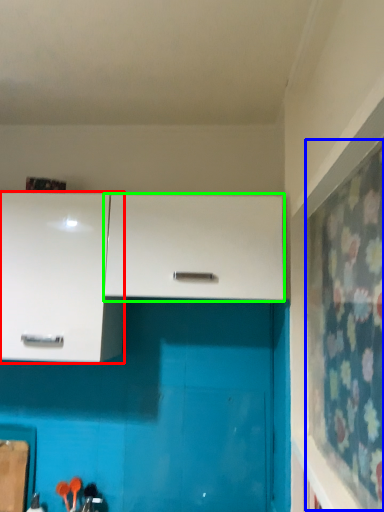
Question: Based on their relative distances, which object is farther from cabinetry (highlighted by a red box)? Choose from curtain (highlighted by a blue box) and cabinetry (highlighted by a green box).

Choices:
 (A) curtain
 (B) cabinetry

Answer: (A)